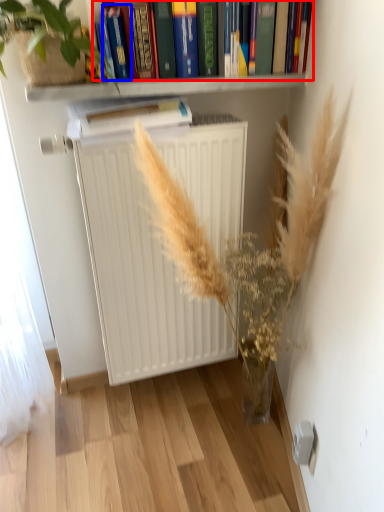
Question: Which point is closer to the camera, book (highlighted by a red box) or paperback book (highlighted by a blue box)?

Choices:
 (A) book
 (B) paperback book

Answer: (B)